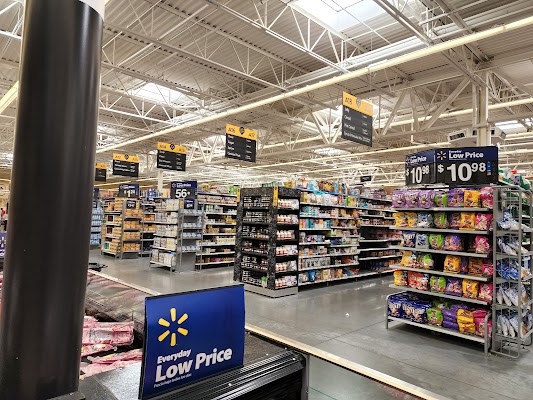
Find the location of a particular element. Image resolution: width=533 pixels, height=400 pixels. lights is located at coordinates (154, 92), (337, 111), (511, 124).